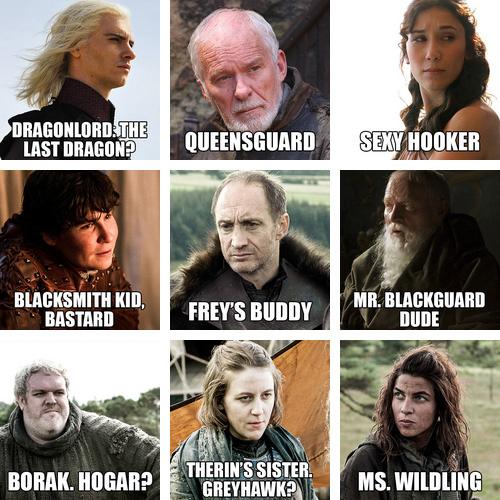
This screenshot has height=500, width=500. Identify the location of rectangular pictures of fantasy actors. (2, 7), (172, 6), (348, 4), (4, 175), (172, 173), (344, 176), (1, 346), (172, 344), (344, 344).